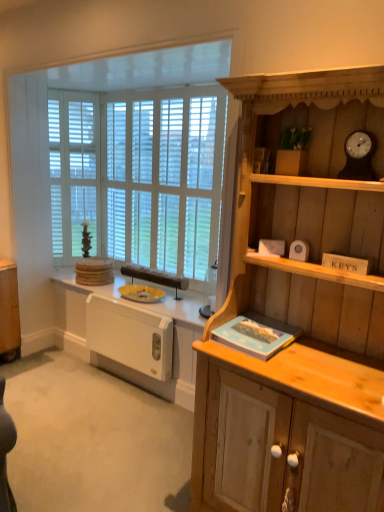
Image resolution: width=384 pixels, height=512 pixels. What do you see at coordinates (300, 313) in the screenshot?
I see `light wood cabinet at right` at bounding box center [300, 313].

The height and width of the screenshot is (512, 384). What do you see at coordinates (130, 336) in the screenshot?
I see `white plastic radiator at lower left` at bounding box center [130, 336].

The width and height of the screenshot is (384, 512). Describe the element at coordinates (358, 156) in the screenshot. I see `wooden clock at upper right` at that location.

I want to click on light wood cabinet at right, so click(300, 313).

Is white wooden window at upper left spatially inside white wood blinds at left, or outside of it?

The correct answer is: outside.

From the image's perspective, between white wooden window at upper left and white wood blinds at left, who is located below?

white wooden window at upper left, from the image's perspective.

Does point (56, 196) come farther from viewer compared to point (56, 180)?

That is True.

Considering the sizes of white wooden window at upper left and white wood blinds at left in the image, is white wooden window at upper left taller or shorter than white wood blinds at left?

In the image, white wooden window at upper left appears to be taller than white wood blinds at left.

Does white wood blinds at left appear on the left side of white matte radiator at lower left?

Correct, you'll find white wood blinds at left to the left of white matte radiator at lower left.

Does white wood blinds at left have a smaller size compared to white matte radiator at lower left?

Incorrect, white wood blinds at left is not smaller in size than white matte radiator at lower left.

The width and height of the screenshot is (384, 512). What are the coordinates of `countertop below the white wood blinds at left (from the image's perspective)` in the screenshot? It's located at (135, 310).

Is white wood blinds at left facing away from white matte radiator at lower left?

That's not correct — white wood blinds at left is not looking away from white matte radiator at lower left.

Is there a large distance between white plastic radiator at lower left and white matte radiator at lower left?

That's not correct — white plastic radiator at lower left is a little close to white matte radiator at lower left.

Can you confirm if white plastic radiator at lower left is shorter than white matte radiator at lower left?

No, white plastic radiator at lower left is not shorter than white matte radiator at lower left.

From a real-world perspective, is white plastic radiator at lower left above or below white matte radiator at lower left?

In terms of real-world spatial position, white plastic radiator at lower left is above white matte radiator at lower left.

Is light wood cabinet at right facing away from wooden clock at upper right?

Yes, light wood cabinet at right's orientation is away from wooden clock at upper right.

Considering the positions of point (341, 398) and point (372, 170), is point (341, 398) closer or farther from the camera than point (372, 170)?

Point (341, 398) is positioned closer to the camera compared to point (372, 170).

In the scene shown: Is light wood cabinet at right positioned before wooden clock at upper right?

Yes, light wood cabinet at right is closer to the viewer.

Is white wooden window at upper left positioned far away from light wood cabinet at right?

Yes, white wooden window at upper left is far from light wood cabinet at right.

This screenshot has width=384, height=512. I want to click on cabinetry in front of the white wooden window at upper left, so click(300, 313).

Which is behind, point (211, 161) or point (349, 404)?

Point (211, 161)

Are white plastic radiator at lower left and wooden clock at upper right located far from each other?

Yes, white plastic radiator at lower left and wooden clock at upper right are quite far apart.

Is white plastic radiator at lower left aimed at wooden clock at upper right?

No, white plastic radiator at lower left is not turned towards wooden clock at upper right.

Considering the positions of objects white plastic radiator at lower left and wooden clock at upper right in the image provided, who is more to the right, white plastic radiator at lower left or wooden clock at upper right?

From the viewer's perspective, wooden clock at upper right appears more on the right side.

Is wooden clock at upper right located within white plastic radiator at lower left?

No, wooden clock at upper right is not inside white plastic radiator at lower left.

Is white plastic radiator at lower left not near light wood cabinet at right?

white plastic radiator at lower left is far away from light wood cabinet at right.

Which is correct: white plastic radiator at lower left is inside light wood cabinet at right, or outside of it?

The correct answer is: outside.

Who is smaller, white plastic radiator at lower left or light wood cabinet at right?

With smaller size is white plastic radiator at lower left.

The image size is (384, 512). In order to click on glass door located above the white wooden window at upper left (from a real-world perspective) in this screenshot , I will do `click(74, 173)`.

Where is `glass door behind the white matte radiator at lower left`? glass door behind the white matte radiator at lower left is located at coordinates (74, 173).

Consider the image. From the image, which object appears to be nearer to white wooden window at upper left, wooden clock at upper right or white matte radiator at lower left?

white matte radiator at lower left is positioned closer to the anchor white wooden window at upper left.

Based on their spatial positions, is wooden clock at upper right or white matte radiator at lower left further from white plastic radiator at lower left?

wooden clock at upper right is further to white plastic radiator at lower left.

When comparing their distances from white wooden blinds at center, does white wood blinds at left or white matte radiator at lower left seem closer?

white wood blinds at left lies closer to white wooden blinds at center than the other object.

Looking at the image, which one is located closer to white wooden window at upper left, white wood blinds at left or white plastic radiator at lower left?

The object closer to white wooden window at upper left is white wood blinds at left.

Considering their positions, is white wood blinds at left positioned further to wooden clock at upper right than white plastic radiator at lower left?

Based on the image, white wood blinds at left appears to be further to wooden clock at upper right.

From the picture: Which object lies nearer to the anchor point white plastic radiator at lower left, light wood cabinet at right or white matte radiator at lower left?

Among the two, white matte radiator at lower left is located nearer to white plastic radiator at lower left.

Looking at the image, which one is located further to white plastic radiator at lower left, white matte radiator at lower left or wooden clock at upper right?

wooden clock at upper right.

When comparing their distances from white plastic radiator at lower left, does white wood blinds at left or white matte radiator at lower left seem further?

Among the two, white wood blinds at left is located further to white plastic radiator at lower left.

You are a GUI agent. You are given a task and a screenshot of the screen. Output one action in this format:
    pyautogui.click(x=<x>, y=<y>)
    Task: Click on the window between wooden clock at upper right and white wood blinds at left along the z-axis
    The height and width of the screenshot is (512, 384).
    Given the screenshot: What is the action you would take?
    pyautogui.click(x=140, y=157)

You are a GUI agent. You are given a task and a screenshot of the screen. Output one action in this format:
    pyautogui.click(x=<x>, y=<y>)
    Task: Click on the window screen between light wood cabinet at right and white wood blinds at left in the front-back direction
    This screenshot has height=512, width=384.
    Given the screenshot: What is the action you would take?
    pyautogui.click(x=164, y=179)

Find the location of a particular element. The height and width of the screenshot is (512, 384). countertop between wooden clock at upper right and white wood blinds at left from front to back is located at coordinates (135, 310).

The width and height of the screenshot is (384, 512). Identify the location of window that lies between white wooden blinds at center and white matte radiator at lower left from top to bottom. (140, 157).